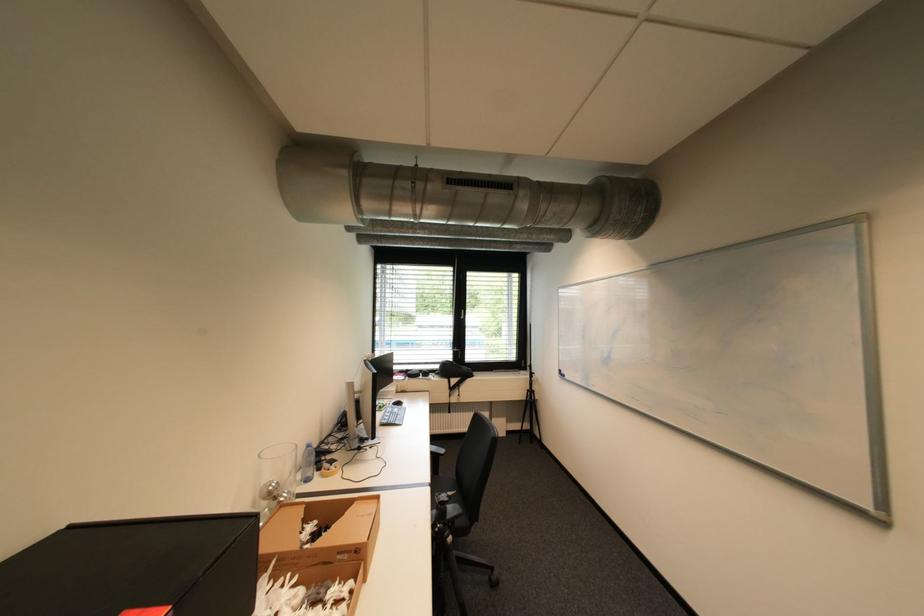
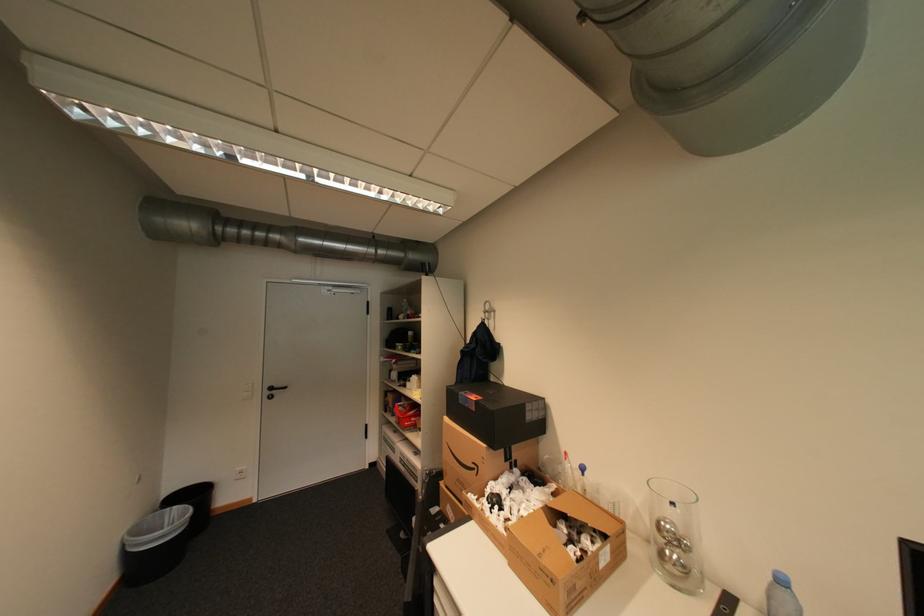
The point at (317, 446) is marked in the first image. Where is the corresponding point in the second image?

(791, 582)